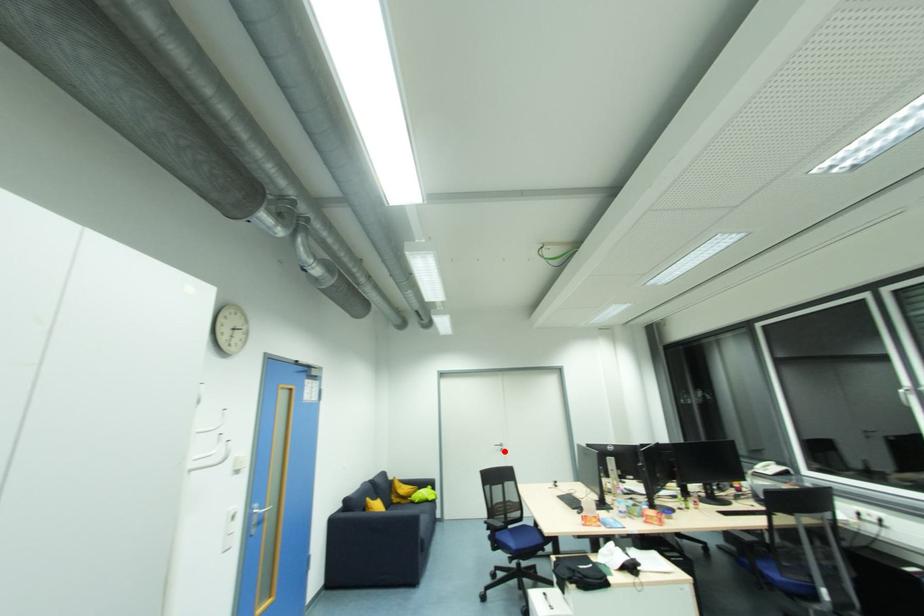
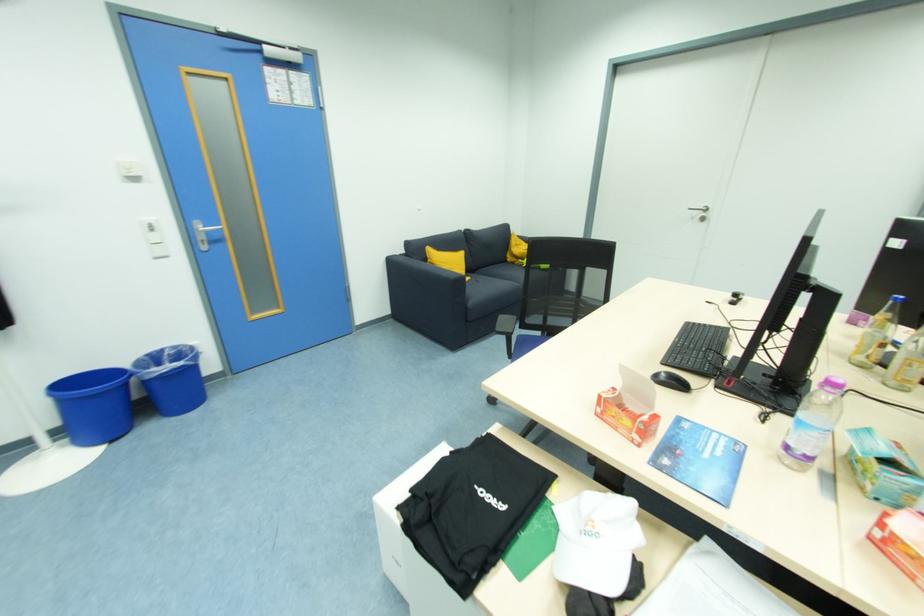
The point at the highlighted location is marked in the first image. Where is the corresponding point in the second image?

(706, 221)